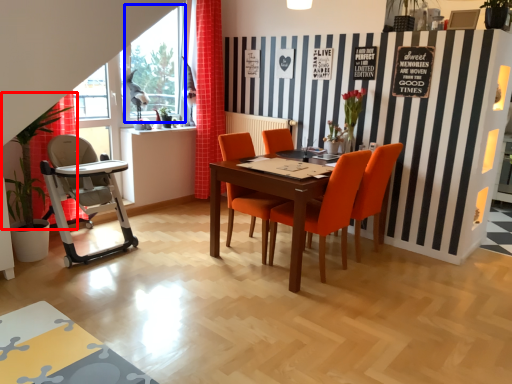
Question: Which of the following is the farthest to the observer, plant (highlighted by a red box) or window screen (highlighted by a blue box)?

Choices:
 (A) plant
 (B) window screen

Answer: (B)